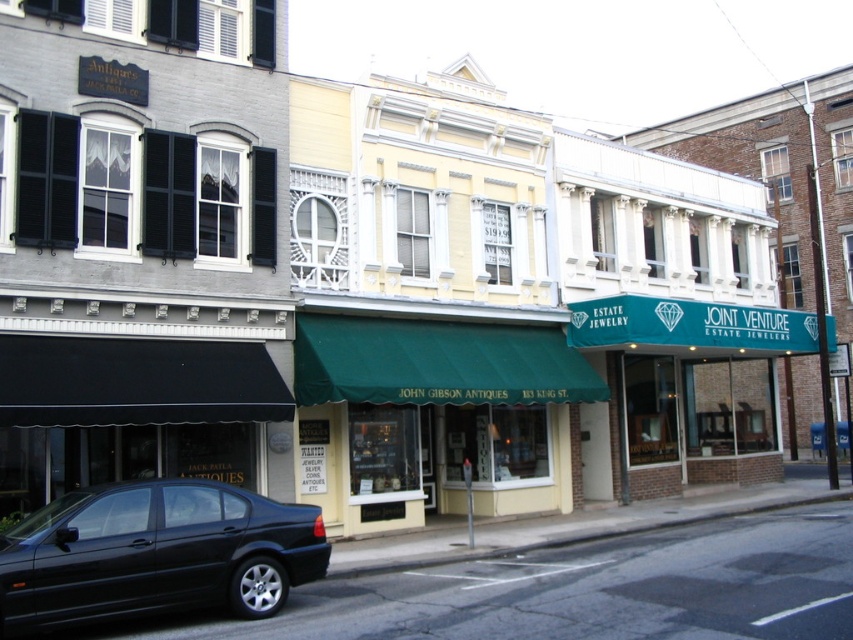
Question: Estimate the real-world distances between objects in this image. Which object is closer to the green fabric awning at center?

Choices:
 (A) teal fabric signboard at center
 (B) shiny black sedan at lower left

Answer: (B)

Question: Can you confirm if shiny black sedan at lower left is positioned to the left of teal fabric signboard at center?

Choices:
 (A) yes
 (B) no

Answer: (A)

Question: Which point is farther to the camera?

Choices:
 (A) green fabric awning at center
 (B) teal fabric signboard at center

Answer: (B)

Question: Which is farther from the teal fabric signboard at center?

Choices:
 (A) green fabric awning at center
 (B) shiny black sedan at lower left

Answer: (B)

Question: Is green fabric awning at center closer to camera compared to teal fabric signboard at center?

Choices:
 (A) no
 (B) yes

Answer: (B)

Question: Is green fabric awning at center wider than teal fabric signboard at center?

Choices:
 (A) no
 (B) yes

Answer: (A)